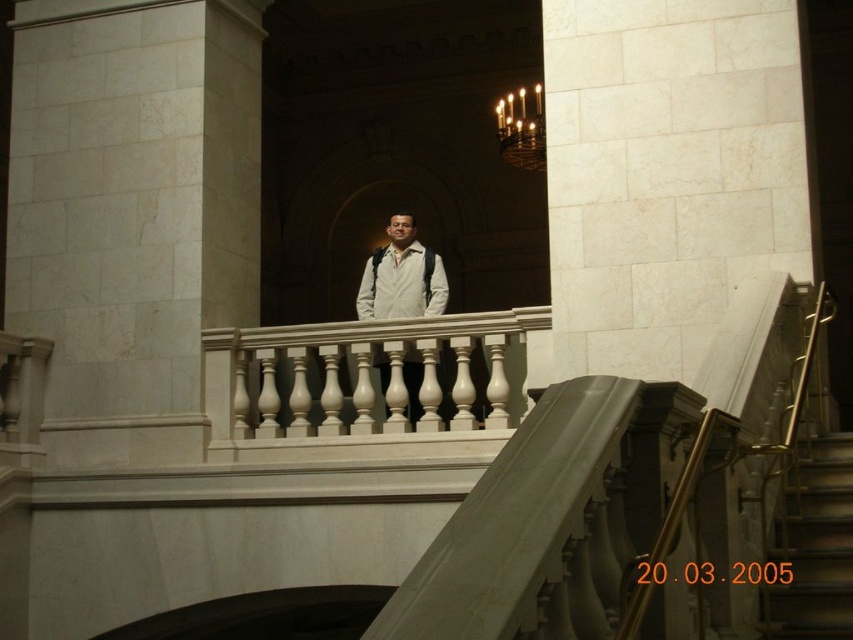
You are standing on the balcony and want to take a photo of the white marble pillar at center and the white marble balustrade at center. Which one should you focus on first if you want to capture both in a single frame without moving the camera?

You should focus on the white marble pillar at center first because it is taller than the white marble balustrade at center, so it will occupy more space in the frame and ensure both are captured effectively.

You are a tour guide in this historical building. You notice the matte white jacket at center and the metallic gold chandelier at upper center. Which object is smaller in size?

The matte white jacket at center is smaller in size compared to the metallic gold chandelier at upper center.

You are standing in the grand building and want to reach the point marked at coordinates point (221, 168). If your walking speed is 3 feet per second, how long will it take you to reach that point?

→ The point (221, 168) is 139.56 feet away from the viewer. At a walking speed of 3 feet per second, it will take approximately 46.52 seconds to reach the point.